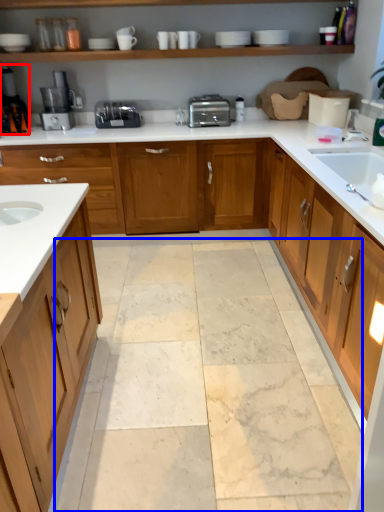
Question: Which object is further to the camera taking this photo, coffee machine (highlighted by a red box) or granite (highlighted by a blue box)?

Choices:
 (A) coffee machine
 (B) granite

Answer: (A)